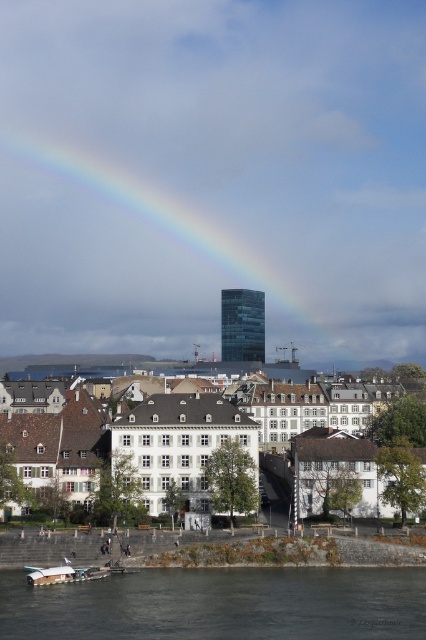
Question: Which point appears farthest from the camera in this image?

Choices:
 (A) (210, 604)
 (B) (100, 572)
 (C) (233, 272)
 (D) (245, 410)

Answer: (C)

Question: Does clear water at lower center appear under white plastic boat at lower left?

Choices:
 (A) no
 (B) yes

Answer: (B)

Question: Among these points, which one is farthest from the camera?

Choices:
 (A) (126, 288)
 (B) (109, 570)
 (C) (226, 429)

Answer: (A)

Question: Can you confirm if clear water at lower center is positioned above white plastic boat at lower left?

Choices:
 (A) yes
 (B) no

Answer: (B)

Question: Does rainbow glass at upper center appear under white wooden houses at center?

Choices:
 (A) no
 (B) yes

Answer: (A)

Question: Which point is closer to the camera?

Choices:
 (A) rainbow glass at upper center
 (B) clear water at lower center
 (C) white plastic boat at lower left
 (D) white wooden houses at center

Answer: (B)